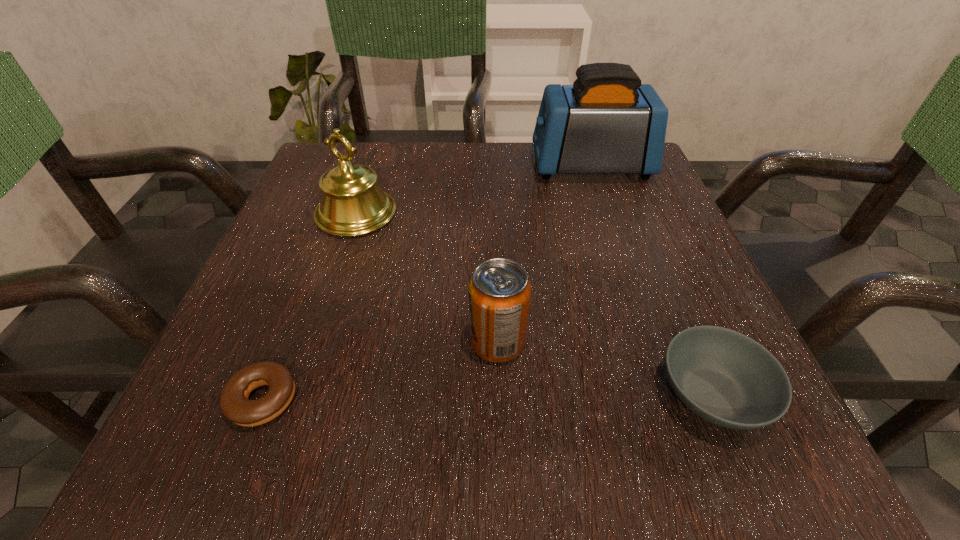
At what (x,y) coordinates should I click in order to perform the action: click on free space located on the front-facing side of the tallest object. Please return your answer as a coordinate pair (x, y). Looking at the image, I should click on (385, 166).

In order to click on free region located on the front of the fourth nearest object in this screenshot , I will do tap(320, 327).

You are a GUI agent. You are given a task and a screenshot of the screen. Output one action in this format:
    pyautogui.click(x=<x>, y=<y>)
    Task: Click on the vacant space located on the left of the third shortest object
    This screenshot has height=540, width=960.
    Given the screenshot: What is the action you would take?
    pyautogui.click(x=359, y=343)

Identify the location of vacant space located on the left of the soup bowl. (375, 394).

At what (x,y) coordinates should I click in order to perform the action: click on free space located on the back of the shortest object. Please return your answer as a coordinate pair (x, y). The height and width of the screenshot is (540, 960). Looking at the image, I should click on (332, 219).

The width and height of the screenshot is (960, 540). Find the location of `toaster present at the far edge`. toaster present at the far edge is located at coordinates (607, 122).

Identify the location of bell present at the far edge. (352, 204).

Where is `soup bowl located at the near edge`? This screenshot has width=960, height=540. soup bowl located at the near edge is located at coordinates (725, 377).

Where is `doughnut that is at the near edge`? The width and height of the screenshot is (960, 540). doughnut that is at the near edge is located at coordinates (234, 403).

The height and width of the screenshot is (540, 960). Find the location of `bell present at the left edge`. bell present at the left edge is located at coordinates (352, 204).